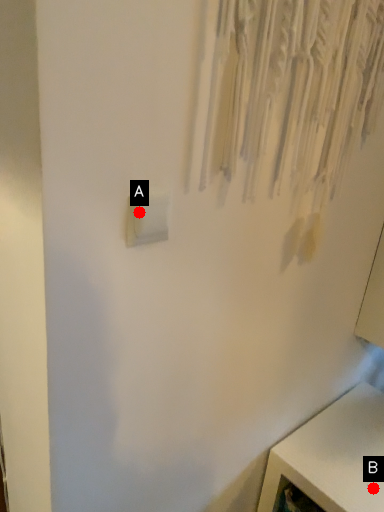
Question: Two points are circled on the image, labeled by A and B beside each circle. Which point is farther to the camera?

Choices:
 (A) A is further
 (B) B is further

Answer: (B)